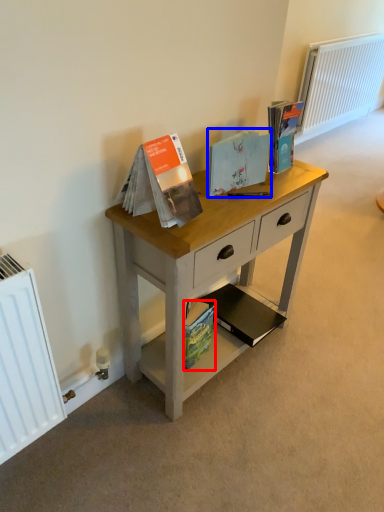
Question: Among these objects, which one is nearest to the camera, paperback book (highlighted by a red box) or paperback book (highlighted by a blue box)?

Choices:
 (A) paperback book
 (B) paperback book

Answer: (B)